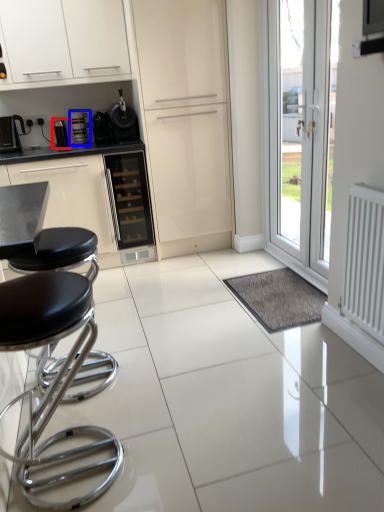
Question: Which object appears farthest to the camera in this image, appliance (highlighted by a red box) or coffee machine (highlighted by a blue box)?

Choices:
 (A) appliance
 (B) coffee machine

Answer: (A)